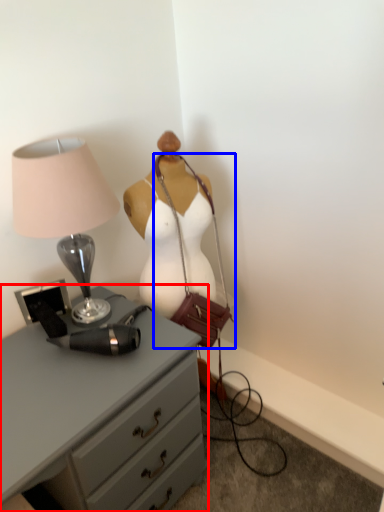
Question: Which object is closer to the camera taking this photo, chest of drawers (highlighted by a red box) or handbag (highlighted by a blue box)?

Choices:
 (A) chest of drawers
 (B) handbag

Answer: (A)